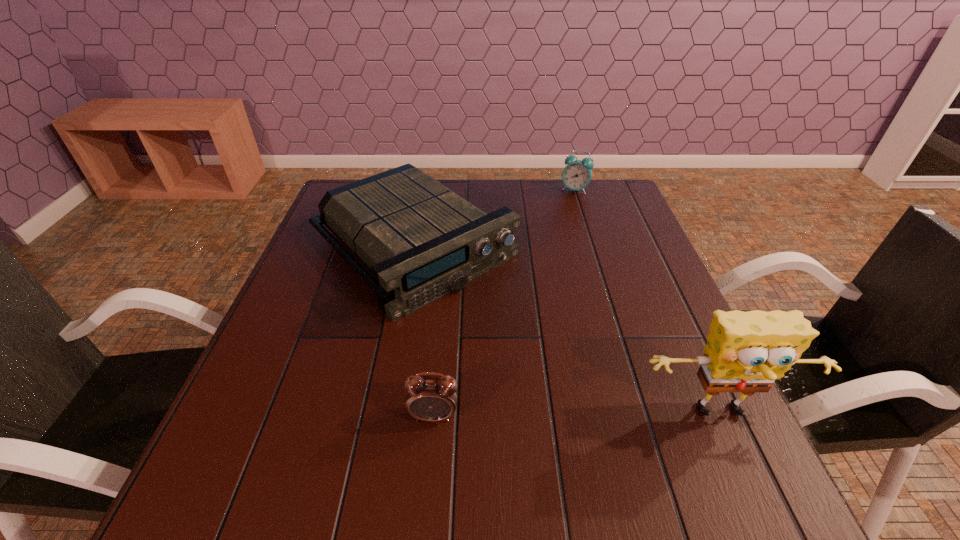
This screenshot has height=540, width=960. I want to click on vacant spot on the desktop that is between the left alarm clock and the tallest object and is positioned on the face of the farther alarm clock, so click(576, 415).

The height and width of the screenshot is (540, 960). In order to click on vacant space on the desktop that is between the nearer alarm clock and the tallest object and is positioned on the front panel of the radio receiver in this screenshot , I will do `click(612, 415)`.